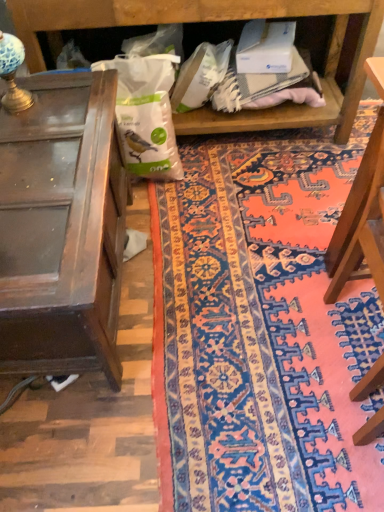
In order to click on unoccupied area behind wooden chair at right in this screenshot , I will do `click(294, 254)`.